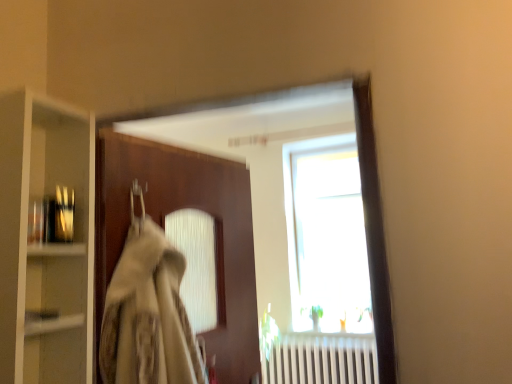
Question: Does point (248, 278) appear closer or farther from the camera than point (73, 193)?

Choices:
 (A) closer
 (B) farther

Answer: (B)

Question: Do you think brown wooden door at center is within metallic glass bottles at left, or outside of it?

Choices:
 (A) outside
 (B) inside

Answer: (A)

Question: Which object is the farthest from the metallic glass bottles at left?

Choices:
 (A) clear glass cabinet at left
 (B) brown wooden door at center

Answer: (B)

Question: Which of these objects is positioned closest to the clear glass cabinet at left?

Choices:
 (A) metallic glass bottles at left
 (B) brown wooden door at center

Answer: (A)